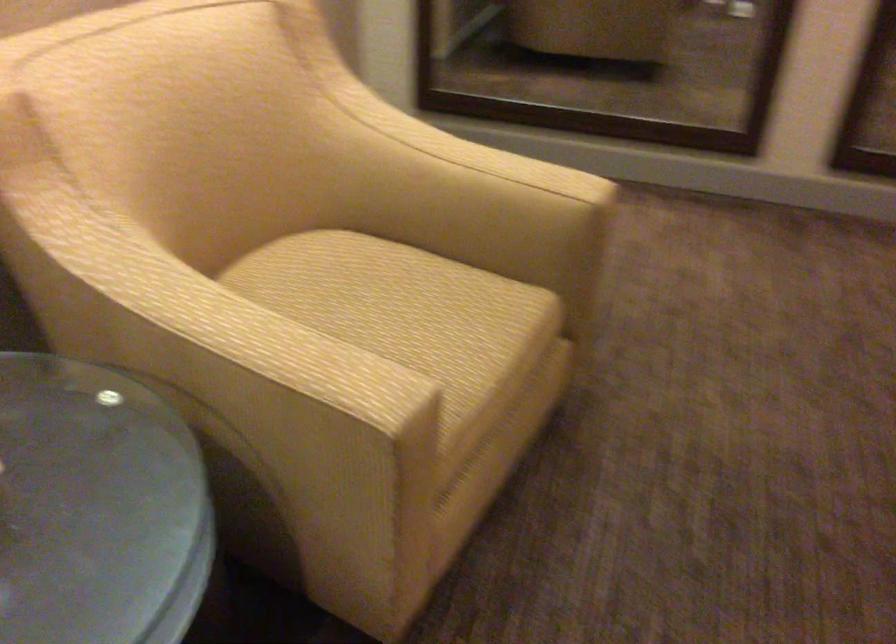
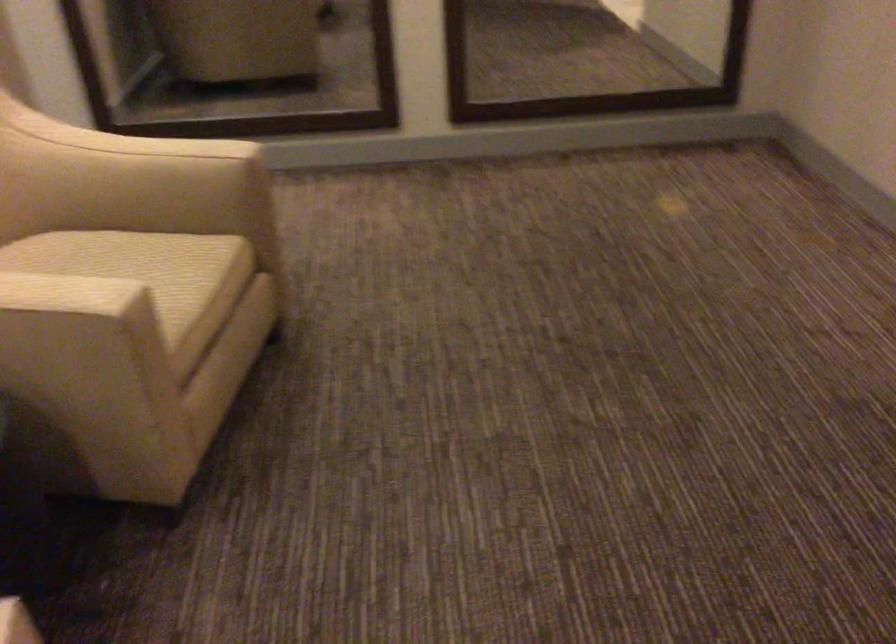
Where in the second image is the point corresponding to pixel 431 314 from the first image?

(143, 268)